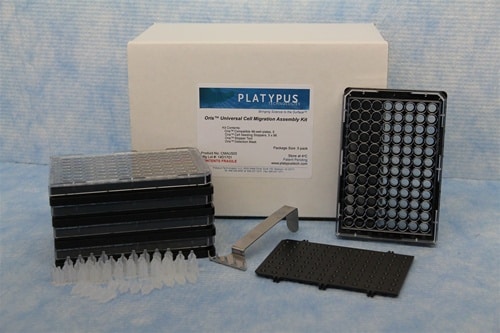
Where is `trays`? Image resolution: width=500 pixels, height=333 pixels. trays is located at coordinates (201, 184).